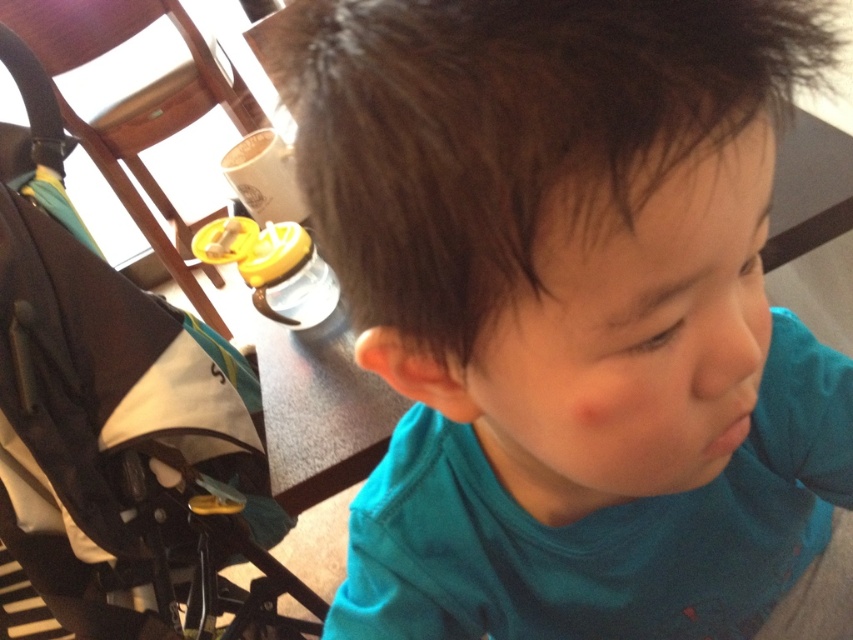
Question: Among these points, which one is farthest from the camera?

Choices:
 (A) (120, 612)
 (B) (334, 74)

Answer: (A)

Question: Where is teal matte shirt at center located in relation to black fabric stroller at left in the image?

Choices:
 (A) above
 (B) below

Answer: (A)

Question: Can you confirm if teal matte shirt at center is positioned below black fabric stroller at left?

Choices:
 (A) yes
 (B) no

Answer: (B)

Question: Which object appears farthest from the camera in this image?

Choices:
 (A) black fabric stroller at left
 (B) teal matte shirt at center

Answer: (A)

Question: Does teal matte shirt at center appear on the left side of black fabric stroller at left?

Choices:
 (A) yes
 (B) no

Answer: (B)

Question: Which point appears closest to the camera in this image?

Choices:
 (A) (125, 460)
 (B) (448, 326)

Answer: (B)